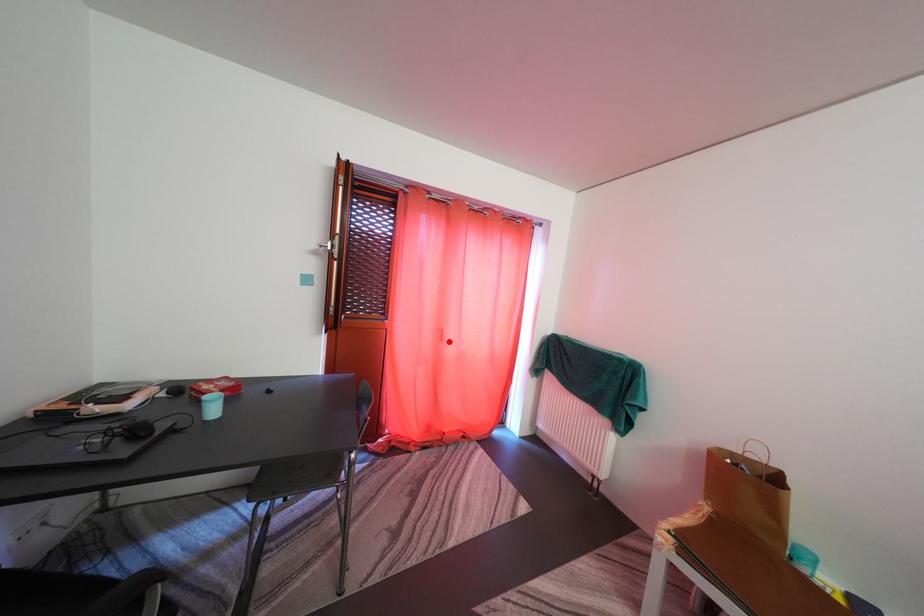
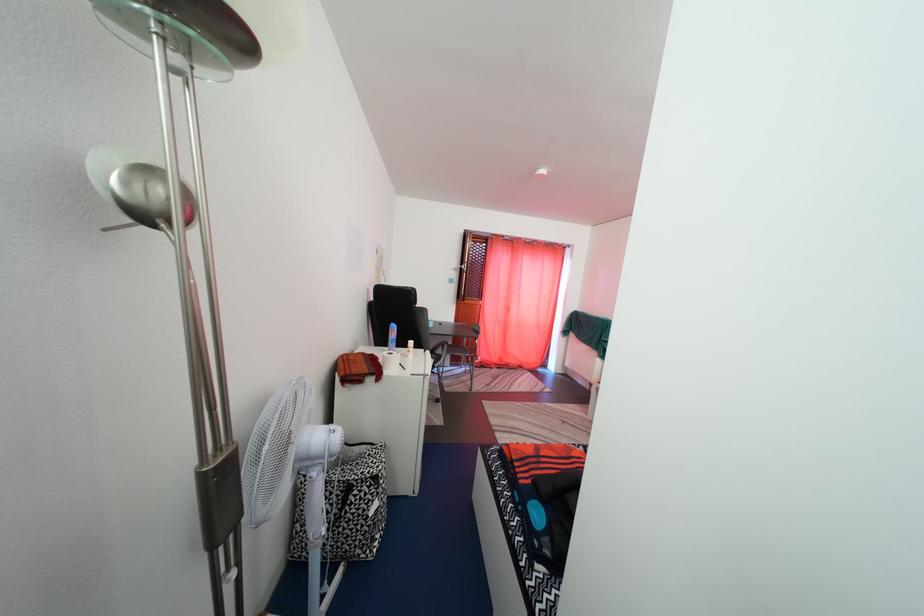
In the second image, find the point that corresponds to the highlighted location in the first image.

(517, 315)